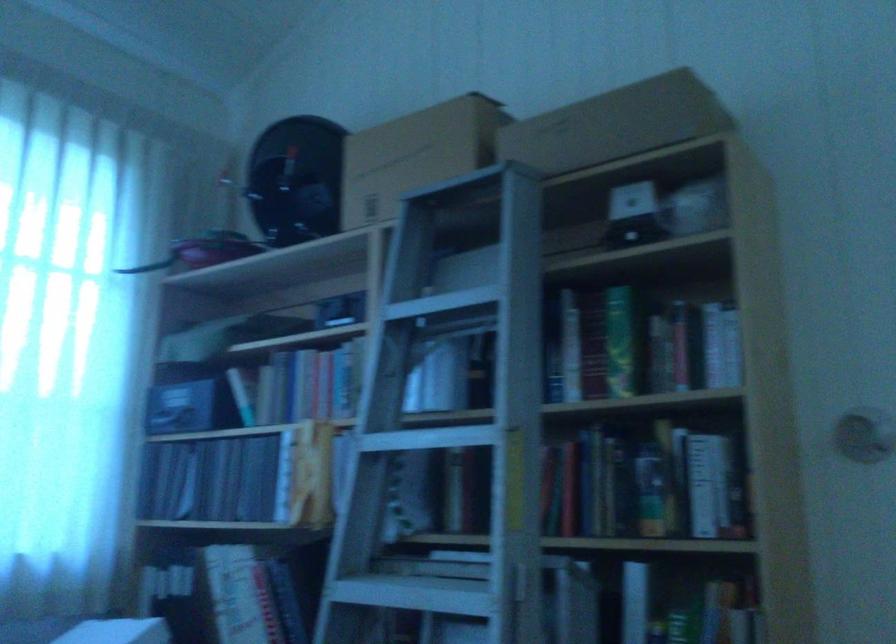
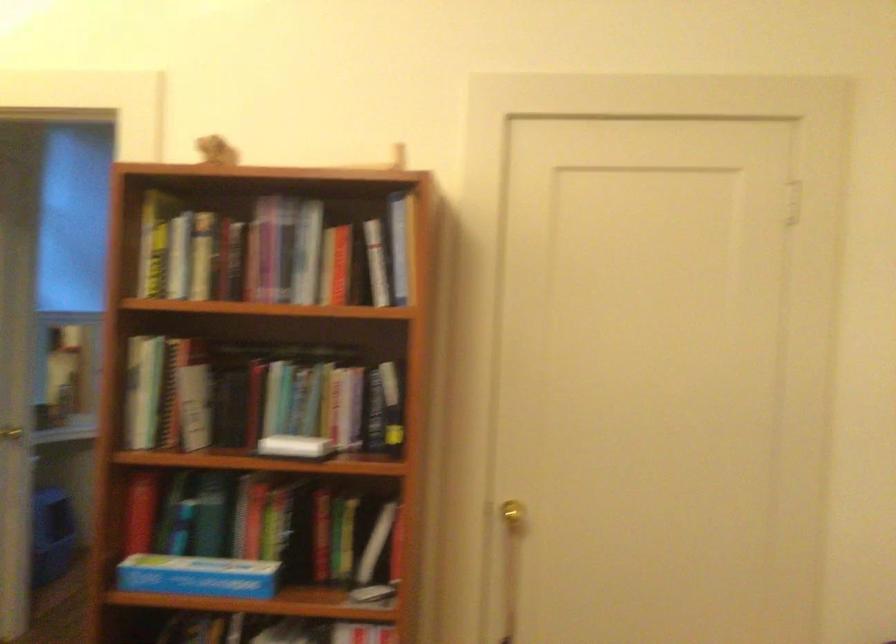
Question: I am providing you with two images of the same scene from different viewpoints. After the viewpoint changes to image2, which objects are now occluded?

Choices:
 (A) gold door knob
 (B) white hair dryer
 (C) silver door knob
 (D) cardboard box

Answer: (D)